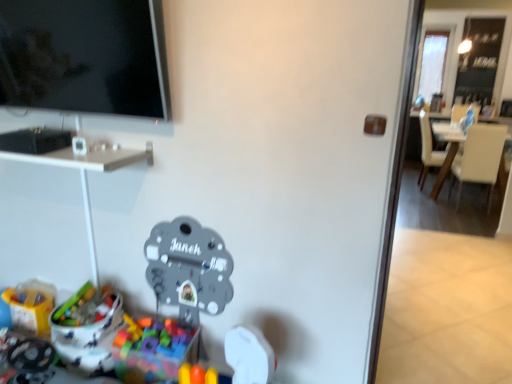
Question: Does white leather chair at right, the 2th chair positioned from the back, lie in front of white glossy desk at upper left?

Choices:
 (A) no
 (B) yes

Answer: (A)

Question: Could you tell me if white leather chair at right, the 2th chair positioned from the back, is facing white glossy desk at upper left?

Choices:
 (A) yes
 (B) no

Answer: (B)

Question: Is white leather chair at right, which is the first chair in front-to-back order, positioned far away from white glossy desk at upper left?

Choices:
 (A) yes
 (B) no

Answer: (A)

Question: Can you confirm if white leather chair at right, which is the first chair in front-to-back order, is bigger than white glossy desk at upper left?

Choices:
 (A) no
 (B) yes

Answer: (B)

Question: Does white leather chair at right, which is the first chair in front-to-back order, come behind white glossy desk at upper left?

Choices:
 (A) yes
 (B) no

Answer: (A)

Question: From a real-world perspective, is metallic gray clock at center, the third toy positioned from the left, above or below white leather chair at right, the 2th chair positioned from the back?

Choices:
 (A) below
 (B) above

Answer: (A)

Question: Does point (221, 309) appear closer or farther from the camera than point (442, 177)?

Choices:
 (A) closer
 (B) farther

Answer: (A)

Question: In the image, is metallic gray clock at center, the third toy positioned from the left, on the left side or the right side of white leather chair at right, the 2th chair positioned from the back?

Choices:
 (A) right
 (B) left

Answer: (B)

Question: Considering the positions of metallic gray clock at center, which appears as the first toy when viewed from the right, and white leather chair at right, the 2th chair positioned from the back, in the image, is metallic gray clock at center, which appears as the first toy when viewed from the right, wider or thinner than white leather chair at right, the 2th chair positioned from the back,?

Choices:
 (A) thin
 (B) wide

Answer: (A)

Question: Considering the positions of metallic gray clock at center, the third toy positioned from the left, and white glossy desk at upper left in the image, is metallic gray clock at center, the third toy positioned from the left, taller or shorter than white glossy desk at upper left?

Choices:
 (A) short
 (B) tall

Answer: (B)

Question: Is point (186, 274) positioned closer to the camera than point (67, 162)?

Choices:
 (A) closer
 (B) farther

Answer: (B)

Question: Considering the relative positions of metallic gray clock at center, which appears as the first toy when viewed from the right, and white glossy desk at upper left in the image provided, is metallic gray clock at center, which appears as the first toy when viewed from the right, to the left or to the right of white glossy desk at upper left?

Choices:
 (A) right
 (B) left

Answer: (A)

Question: From a real-world perspective, is metallic gray clock at center, which appears as the first toy when viewed from the right, above or below white glossy desk at upper left?

Choices:
 (A) above
 (B) below

Answer: (B)

Question: Is white leather chair at right, positioned as the first chair in back-to-front order, in front of or behind white leather armchair at upper right in the image?

Choices:
 (A) front
 (B) behind

Answer: (A)

Question: Choose the correct answer: Is white leather chair at right, positioned as the first chair in back-to-front order, inside white leather armchair at upper right or outside it?

Choices:
 (A) inside
 (B) outside

Answer: (B)